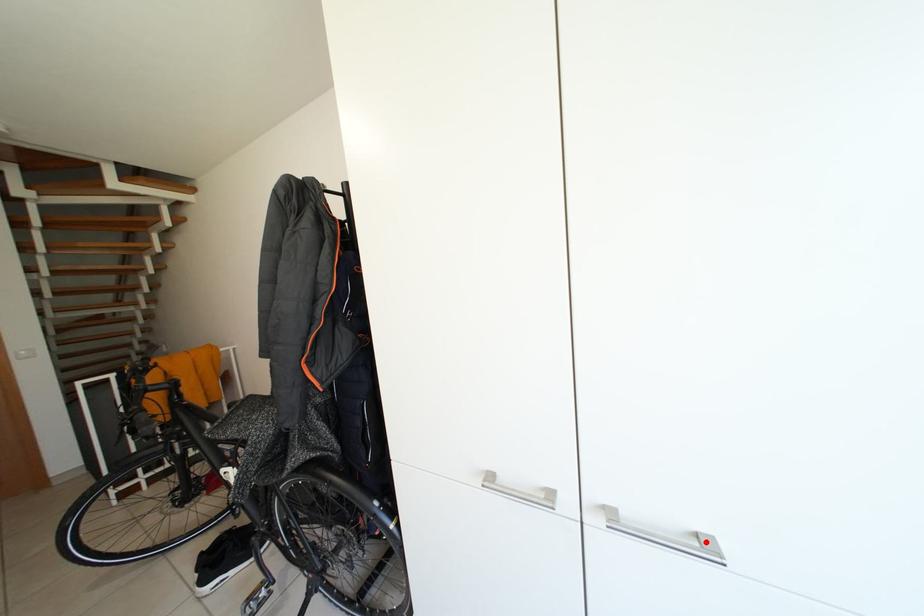
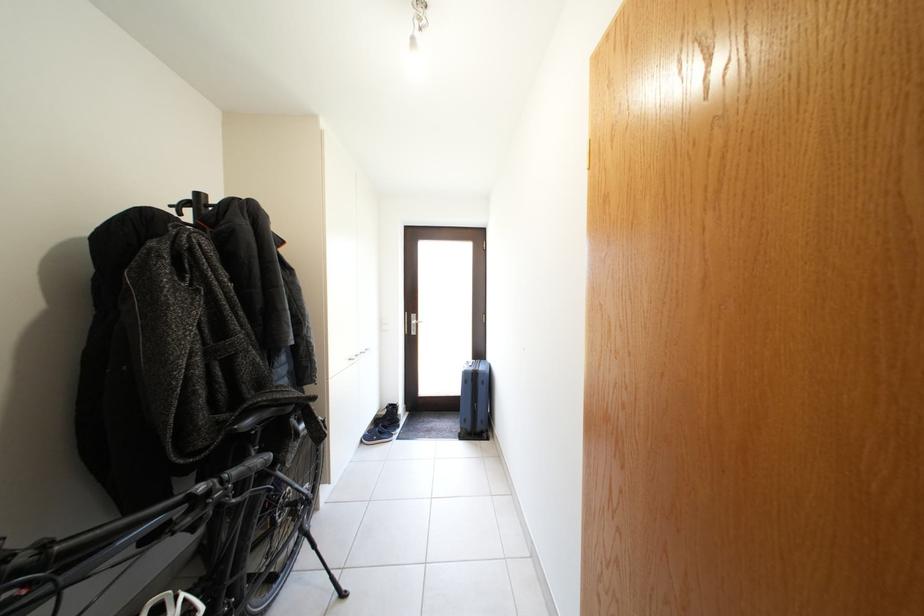
Question: I am providing you with two images of the same scene from different viewpoints. A red point is marked on the first image. Is the red point's position out of view in image 2?

Choices:
 (A) Yes
 (B) No

Answer: (A)